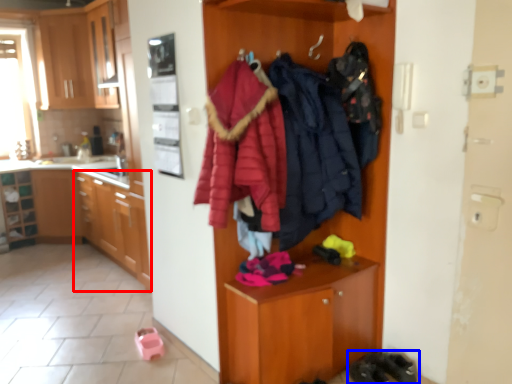
Question: Among these objects, which one is farthest to the camera, cabinetry (highlighted by a red box) or footwear (highlighted by a blue box)?

Choices:
 (A) cabinetry
 (B) footwear

Answer: (A)